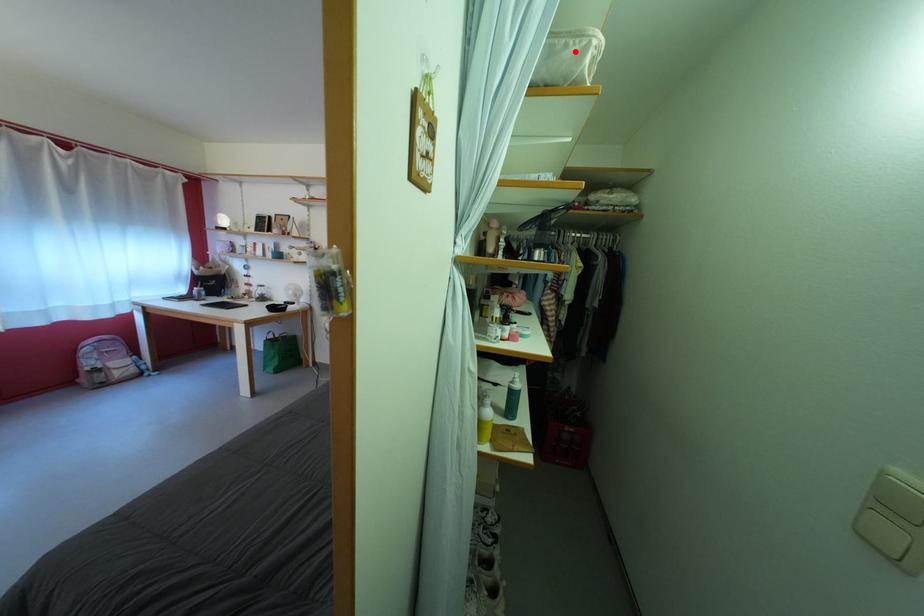
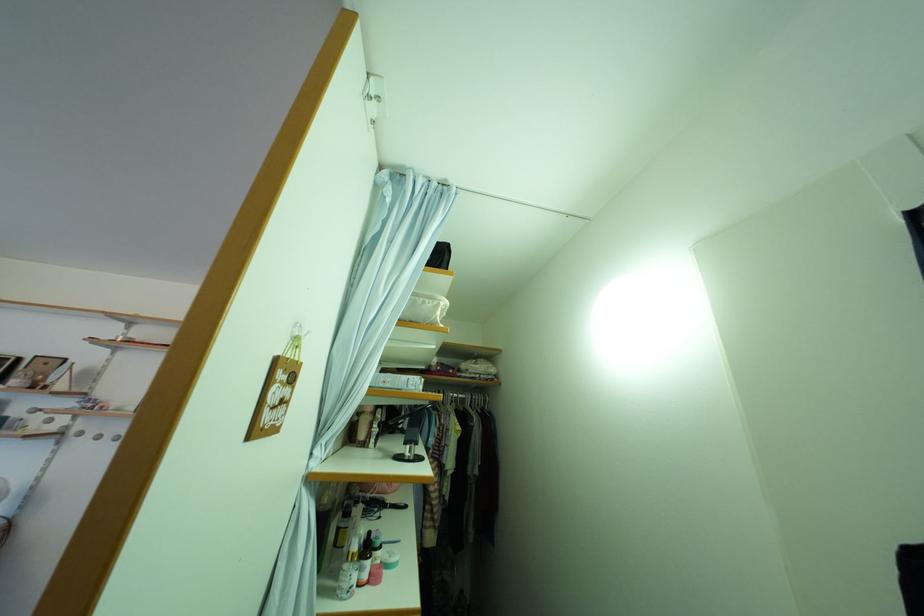
In the second image, find the point that corresponds to the highlighted location in the first image.

(432, 309)